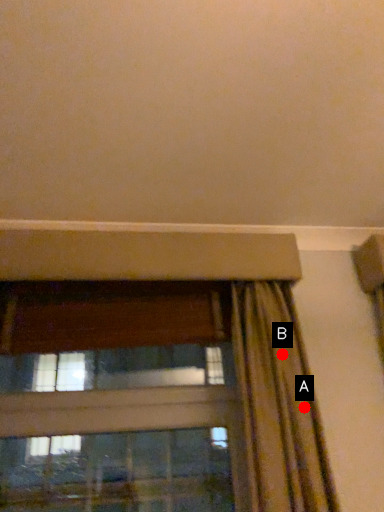
Question: Two points are circled on the image, labeled by A and B beside each circle. Which point is closer to the camera taking this photo?

Choices:
 (A) A is closer
 (B) B is closer

Answer: (A)